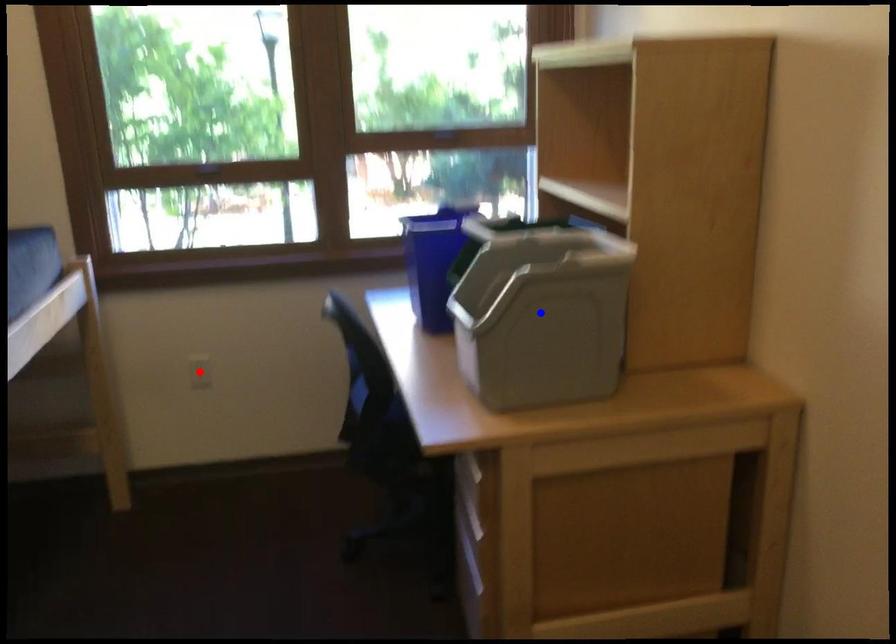
Question: Which of the two points in the image is closer to the camera?

Choices:
 (A) Blue point is closer.
 (B) Red point is closer.

Answer: (A)